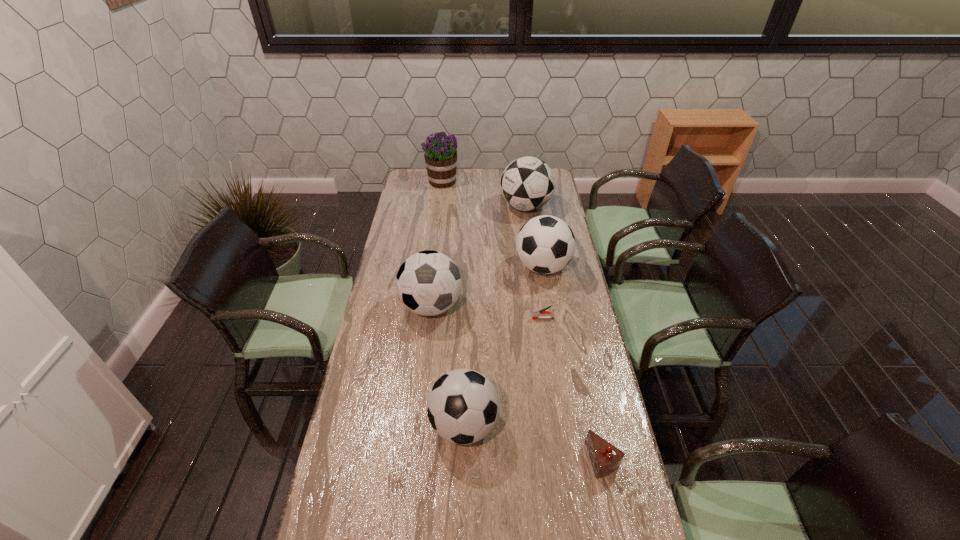
The width and height of the screenshot is (960, 540). I want to click on free space located on the right of the shortest soccer ball, so click(588, 425).

Locate an element on the screen. Image resolution: width=960 pixels, height=540 pixels. vacant area located 0.260m on the left of the chocolate cake is located at coordinates (500, 459).

I want to click on free space located 0.360m on the handle side of the stapler, so click(x=440, y=318).

The image size is (960, 540). In order to click on vacant area situated 0.380m on the handle side of the stapler in this screenshot , I will do `click(435, 318)`.

Locate an element on the screen. This screenshot has width=960, height=540. vacant space located on the handle side of the stapler is located at coordinates (492, 318).

At what (x,y) coordinates should I click in order to perform the action: click on object that is at the far edge. Please return your answer as a coordinate pair (x, y). The width and height of the screenshot is (960, 540). Looking at the image, I should click on point(440,155).

Locate an element on the screen. Image resolution: width=960 pixels, height=540 pixels. bouquet situated at the left edge is located at coordinates (440, 155).

This screenshot has width=960, height=540. Identify the location of soccer ball present at the left edge. (428, 283).

The image size is (960, 540). Find the location of `chocolate cake that is at the right edge`. chocolate cake that is at the right edge is located at coordinates (605, 458).

Image resolution: width=960 pixels, height=540 pixels. Identify the location of stapler positioned at the right edge. (536, 314).